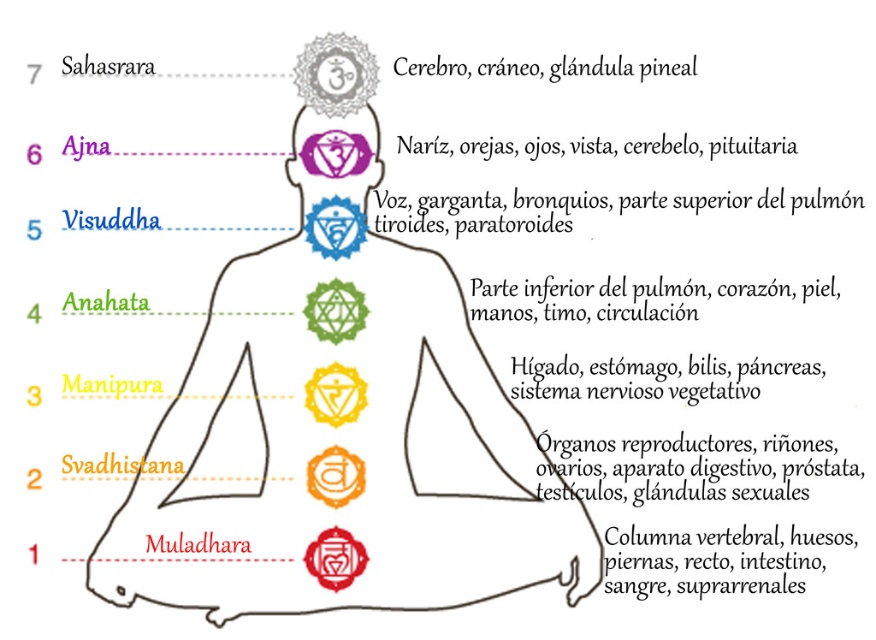
You are a yoga instructor preparing a chakra alignment exercise. You have two chakras in view, the matte purple chakra at upper center and the yellow matte chakra at center. Which of these two chakras is positioned higher up on the body?

The matte purple chakra at upper center is positioned higher up on the body than the yellow matte chakra at center.

You are a yoga instructor observing the chakra diagram. You notice the yellow matte chakra at center and the red glossy circle at lower center. Which chakra is positioned higher in the diagram?

The yellow matte chakra at center is positioned higher than the red glossy circle at lower center in the diagram.